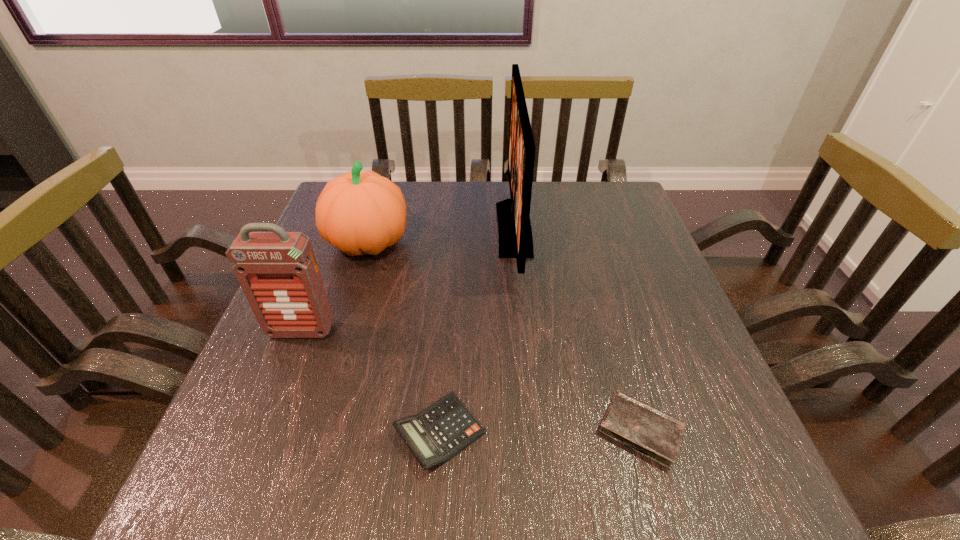
The image size is (960, 540). What are the coordinates of `monitor` in the screenshot? It's located at (514, 227).

Where is `the second object from right to left`? This screenshot has height=540, width=960. the second object from right to left is located at coordinates (514, 227).

Locate an element on the screen. This screenshot has width=960, height=540. the third nearest object is located at coordinates (278, 272).

You are a GUI agent. You are given a task and a screenshot of the screen. Output one action in this format:
    pyautogui.click(x=<x>, y=<y>)
    Task: Click on the fourth shortest object
    Image resolution: width=960 pixels, height=540 pixels.
    Given the screenshot: What is the action you would take?
    pyautogui.click(x=278, y=272)

You are a GUI agent. You are given a task and a screenshot of the screen. Output one action in this format:
    pyautogui.click(x=<x>, y=<y>)
    Task: Click on the pumpkin
    The width and height of the screenshot is (960, 540).
    Given the screenshot: What is the action you would take?
    pyautogui.click(x=359, y=213)

The width and height of the screenshot is (960, 540). In order to click on calculator in this screenshot , I will do `click(435, 435)`.

Where is `the third object from right to left`? the third object from right to left is located at coordinates (435, 435).

Locate an element on the screen. This screenshot has width=960, height=540. diary is located at coordinates (651, 432).

I want to click on the shortest object, so click(x=651, y=432).

Where is `free spot located on the front-facing side of the monitor`? This screenshot has width=960, height=540. free spot located on the front-facing side of the monitor is located at coordinates (396, 229).